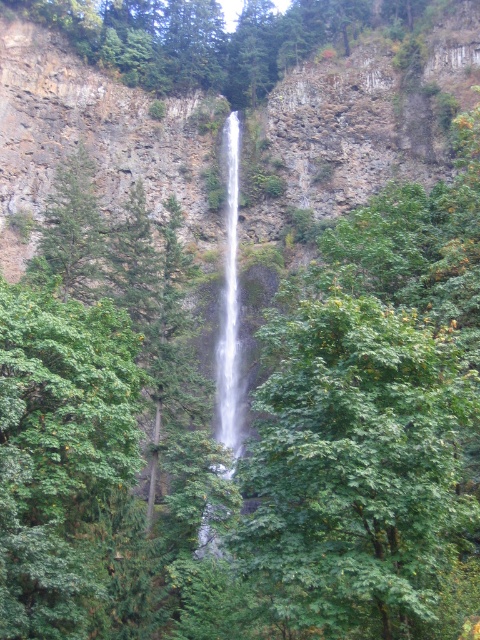
Is clear water at center to the right of white smooth waterfall at center from the viewer's perspective?

No, clear water at center is not to the right of white smooth waterfall at center.

Describe the element at coordinates (229, 308) in the screenshot. The height and width of the screenshot is (640, 480). I see `clear water at center` at that location.

Where is `clear water at center`? Image resolution: width=480 pixels, height=640 pixels. clear water at center is located at coordinates (229, 308).